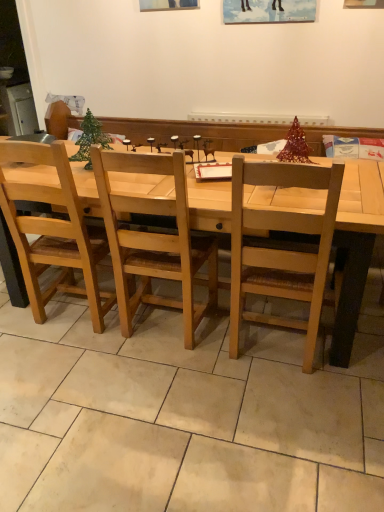
Question: From the image's perspective, is natural wood table at center on light wood chair at center, the 1th chair viewed from the right?

Choices:
 (A) yes
 (B) no

Answer: (A)

Question: Does natural wood table at center have a lesser width compared to light wood chair at center, the 1th chair viewed from the right?

Choices:
 (A) no
 (B) yes

Answer: (A)

Question: Can you confirm if natural wood table at center is taller than light wood chair at center, the 1th chair viewed from the right?

Choices:
 (A) yes
 (B) no

Answer: (B)

Question: From a real-world perspective, is natural wood table at center on light wood chair at center, the 1th chair viewed from the right?

Choices:
 (A) yes
 (B) no

Answer: (B)

Question: Is natural wood table at center outside of light wood chair at center, the 2th chair viewed from the left?

Choices:
 (A) no
 (B) yes

Answer: (B)

Question: Is light wood chair at center, the 1th chair viewed from the right, surrounded by natural wood table at center?

Choices:
 (A) no
 (B) yes

Answer: (B)

Question: Is light brown wood chair at center, the first chair positioned from the left, next to natural wood table at center and touching it?

Choices:
 (A) no
 (B) yes

Answer: (A)

Question: Does light brown wood chair at center, the second chair positioned from the right, have a larger size compared to natural wood table at center?

Choices:
 (A) no
 (B) yes

Answer: (A)

Question: Is light brown wood chair at center, the first chair positioned from the left, shorter than natural wood table at center?

Choices:
 (A) no
 (B) yes

Answer: (A)

Question: Considering the relative positions of light brown wood chair at center, the first chair positioned from the left, and natural wood table at center in the image provided, is light brown wood chair at center, the first chair positioned from the left, to the left of natural wood table at center from the viewer's perspective?

Choices:
 (A) no
 (B) yes

Answer: (B)

Question: Can you confirm if light brown wood chair at center, the first chair positioned from the left, is wider than natural wood table at center?

Choices:
 (A) yes
 (B) no

Answer: (B)

Question: Is light brown wood chair at center, the second chair positioned from the right, looking in the opposite direction of natural wood table at center?

Choices:
 (A) yes
 (B) no

Answer: (A)

Question: Are natural wood table at center and metallic green christmas tree at center located far from each other?

Choices:
 (A) yes
 (B) no

Answer: (B)